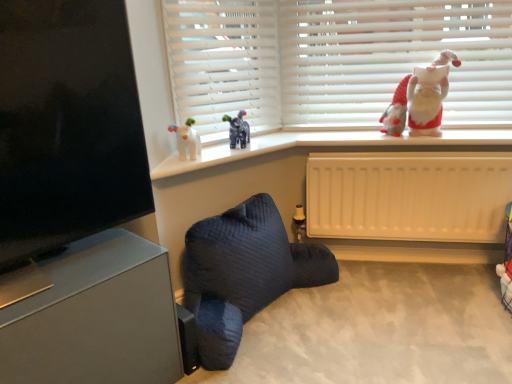
Question: From the image's perspective, is black matte screen at upper left beneath dark blue quilted bean bag chair at lower center?

Choices:
 (A) no
 (B) yes

Answer: (A)

Question: Is black matte screen at upper left oriented towards dark blue quilted bean bag chair at lower center?

Choices:
 (A) yes
 (B) no

Answer: (B)

Question: From a real-world perspective, is black matte screen at upper left positioned over dark blue quilted bean bag chair at lower center based on gravity?

Choices:
 (A) no
 (B) yes

Answer: (B)

Question: Is black matte screen at upper left thinner than dark blue quilted bean bag chair at lower center?

Choices:
 (A) yes
 (B) no

Answer: (A)

Question: Considering the relative sizes of black matte screen at upper left and dark blue quilted bean bag chair at lower center in the image provided, is black matte screen at upper left wider than dark blue quilted bean bag chair at lower center?

Choices:
 (A) no
 (B) yes

Answer: (A)

Question: Is point (124, 326) closer or farther from the camera than point (194, 160)?

Choices:
 (A) closer
 (B) farther

Answer: (A)

Question: In terms of size, does matte gray speaker at lower left appear bigger or smaller than white plastic window sill at upper center?

Choices:
 (A) big
 (B) small

Answer: (A)

Question: Considering the positions of matte gray speaker at lower left and white plastic window sill at upper center in the image, is matte gray speaker at lower left taller or shorter than white plastic window sill at upper center?

Choices:
 (A) tall
 (B) short

Answer: (A)

Question: Looking at their shapes, would you say matte gray speaker at lower left is wider or thinner than white plastic window sill at upper center?

Choices:
 (A) thin
 (B) wide

Answer: (A)

Question: From their relative heights in the image, would you say white plastic window sill at upper center is taller or shorter than matte gray speaker at lower left?

Choices:
 (A) tall
 (B) short

Answer: (B)

Question: Is white plastic window sill at upper center wider or thinner than matte gray speaker at lower left?

Choices:
 (A) wide
 (B) thin

Answer: (A)

Question: From the image's perspective, is white plastic window sill at upper center located above or below matte gray speaker at lower left?

Choices:
 (A) below
 (B) above

Answer: (B)

Question: Considering the relative positions of white plastic window sill at upper center and matte gray speaker at lower left in the image provided, is white plastic window sill at upper center to the left or to the right of matte gray speaker at lower left?

Choices:
 (A) left
 (B) right

Answer: (B)

Question: Would you say dark blue quilted bean bag chair at lower center is to the left or to the right of white ceramic santa at upper right in the picture?

Choices:
 (A) left
 (B) right

Answer: (A)

Question: Which is correct: dark blue quilted bean bag chair at lower center is inside white ceramic santa at upper right, or outside of it?

Choices:
 (A) outside
 (B) inside

Answer: (A)